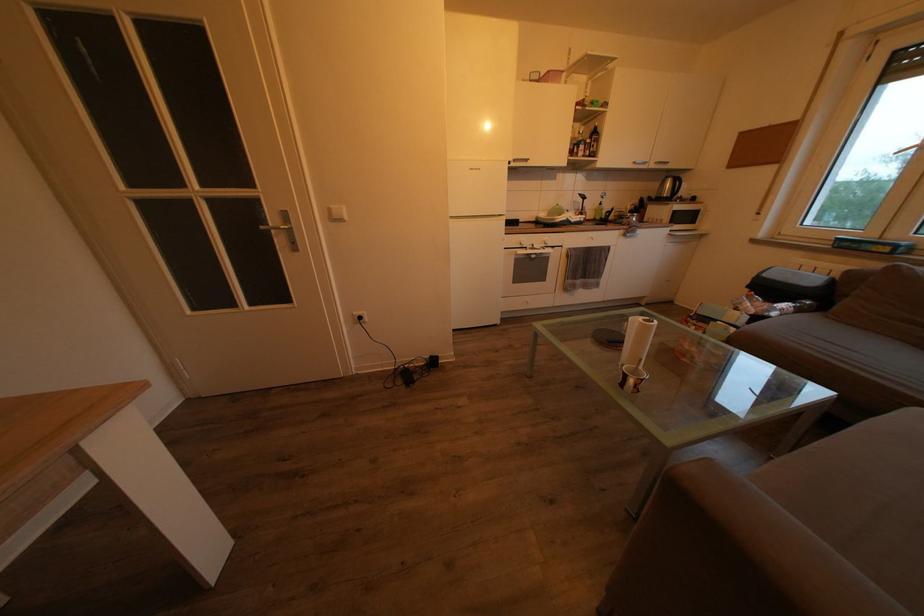
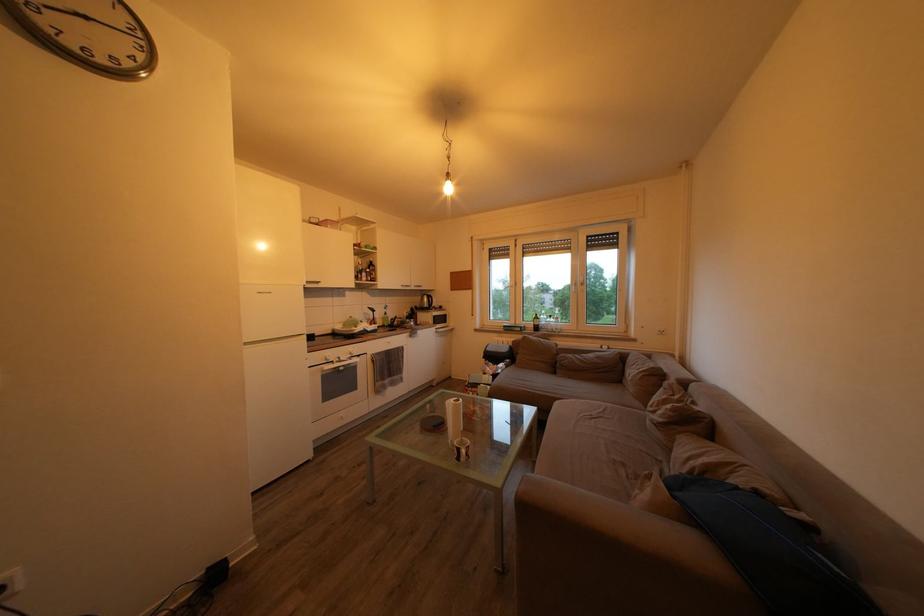
In the second image, find the point that corresponds to the point at 551,222 in the first image.

(346, 333)